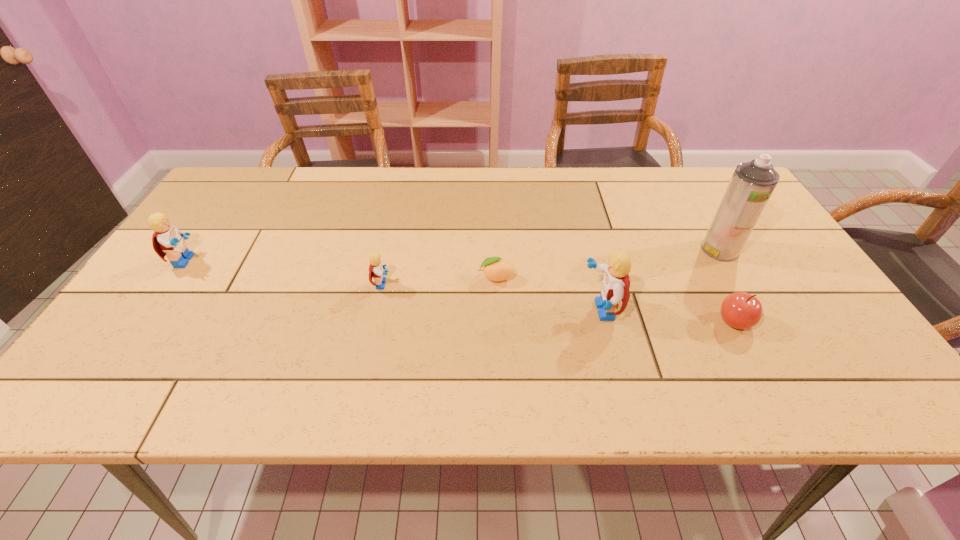
Identify the location of blank region between the aerosol can and the shortest object. (608, 264).

Image resolution: width=960 pixels, height=540 pixels. I want to click on vacant area that lies between the aerosol can and the lemon, so click(x=608, y=264).

Locate an element on the screen. Image resolution: width=960 pixels, height=540 pixels. free space between the second farthest Lego and the aerosol can is located at coordinates (551, 267).

Find the location of a particular element. The width and height of the screenshot is (960, 540). empty location between the nearest Lego and the farthest Lego is located at coordinates (394, 286).

At what (x,y) coordinates should I click in order to perform the action: click on vacant space that is in between the second nearest Lego and the apple. Please return your answer as a coordinate pair (x, y). The height and width of the screenshot is (540, 960). Looking at the image, I should click on coord(559,303).

Find the location of a particular element. Image resolution: width=960 pixels, height=540 pixels. empty location between the apple and the shortest Lego is located at coordinates (559, 303).

Identify the location of vacant area that lies between the apple and the third tallest object. (461, 291).

You are a GUI agent. You are given a task and a screenshot of the screen. Output one action in this format:
    pyautogui.click(x=<x>, y=<y>)
    Task: Click on the vacant space that's between the second farthest Lego and the third object from right to left
    The height and width of the screenshot is (540, 960).
    Given the screenshot: What is the action you would take?
    pyautogui.click(x=492, y=298)

Locate an element on the screen. Image resolution: width=960 pixels, height=540 pixels. vacant region between the second object from left to right and the tallest object is located at coordinates (551, 267).

Choose which object is the third nearest neighbor to the shortest object. Please provide its 2D coordinates. Your answer should be formatted as a tuple, i.e. [(x, y)], where the tuple contains the x and y coordinates of a point satisfying the conditions above.

[(740, 310)]